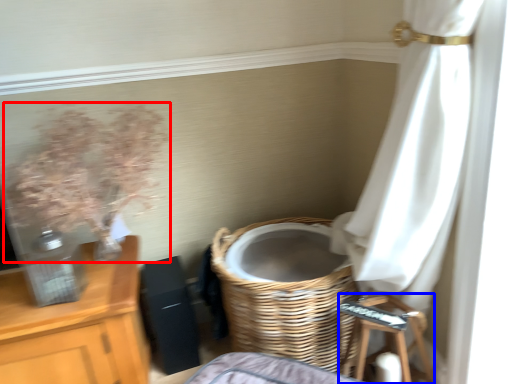
Question: Which object appears farthest to the camera in this image, floral arrangement (highlighted by a red box) or step stool (highlighted by a blue box)?

Choices:
 (A) floral arrangement
 (B) step stool

Answer: (B)